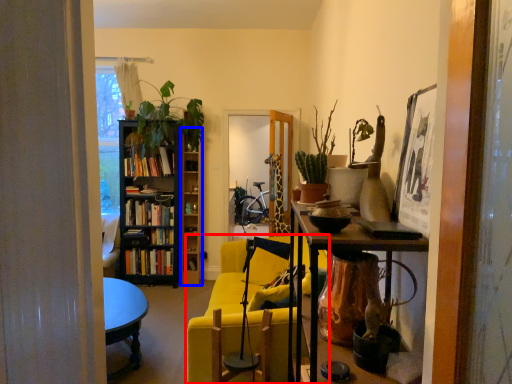
Question: Among these objects, which one is nearest to the camera, chair (highlighted by a red box) or shelf (highlighted by a blue box)?

Choices:
 (A) chair
 (B) shelf

Answer: (A)